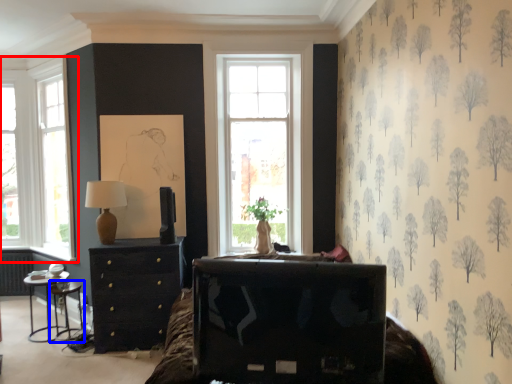
Question: Among these objects, which one is farthest to the camera, window (highlighted by a red box) or side table (highlighted by a blue box)?

Choices:
 (A) window
 (B) side table

Answer: (A)